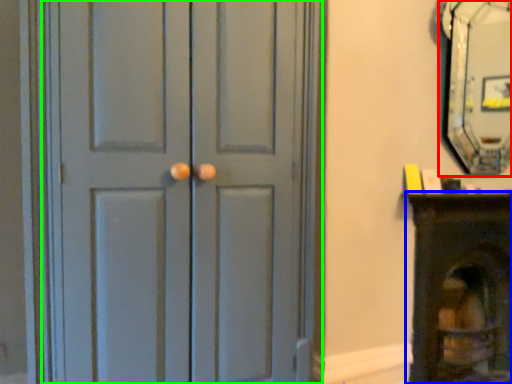
Question: Estimate the real-world distances between objects in this image. Which object is farther from fireplace (highlighted by a red box), furniture (highlighted by a blue box) or door (highlighted by a green box)?

Choices:
 (A) furniture
 (B) door

Answer: (B)